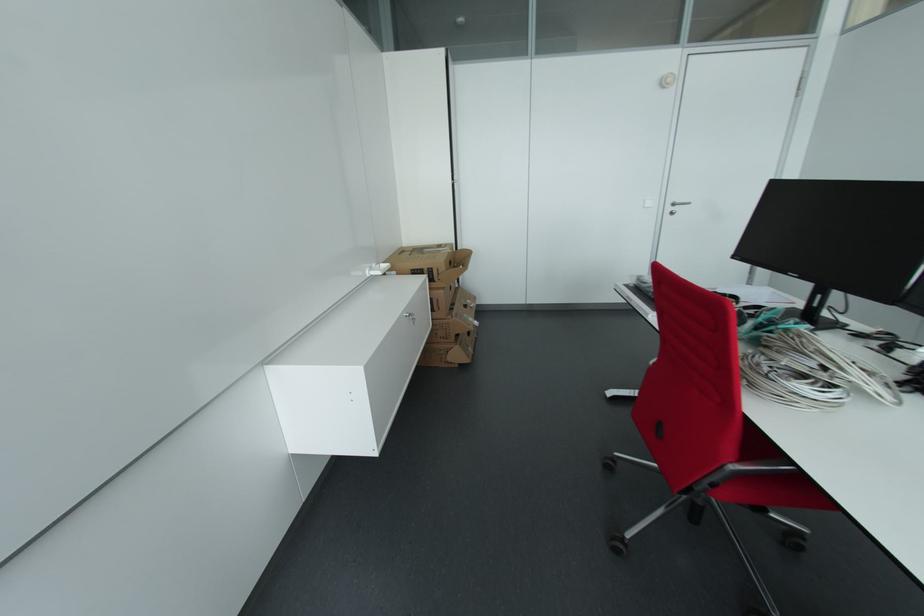
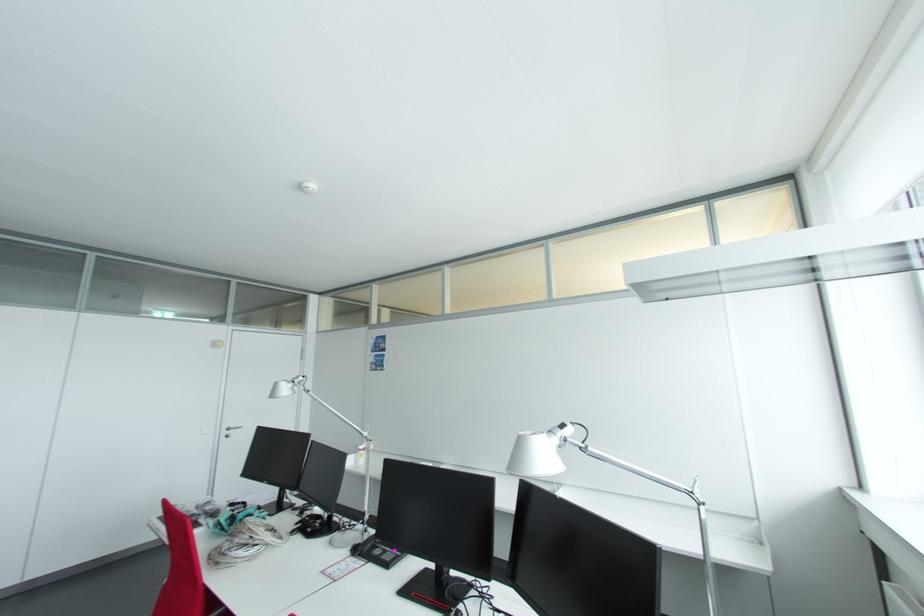
In the second image, find the point that corresponds to the point at 676,206 in the first image.

(232, 430)